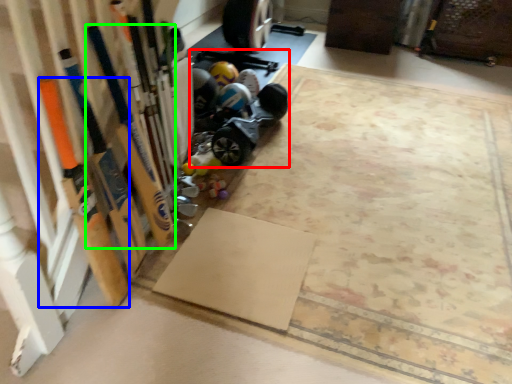
Question: Which object is positioned closest to car (highlighted by a red box)? Select from baseball bat (highlighted by a blue box) and baseball bat (highlighted by a green box).

Choices:
 (A) baseball bat
 (B) baseball bat

Answer: (B)